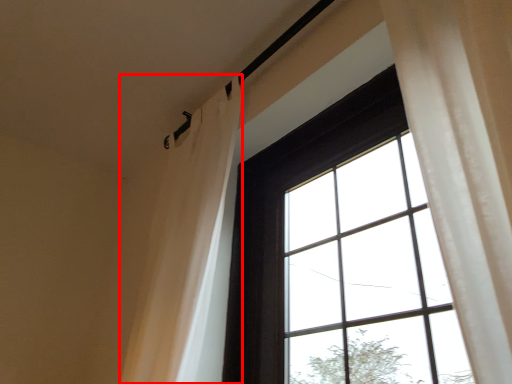
Question: From the image's perspective, where is shower curtain (annotated by the red box) located in relation to window in the image?

Choices:
 (A) below
 (B) above

Answer: (B)